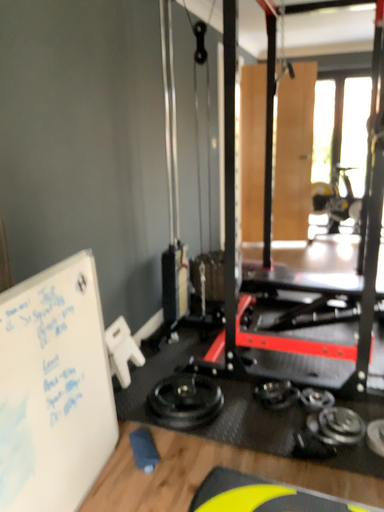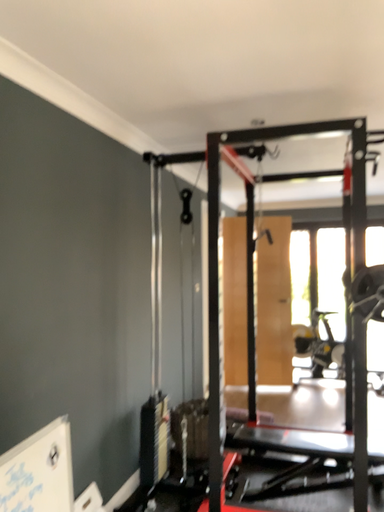
Question: Which way did the camera rotate in the video?

Choices:
 (A) rotated upward
 (B) rotated downward

Answer: (A)